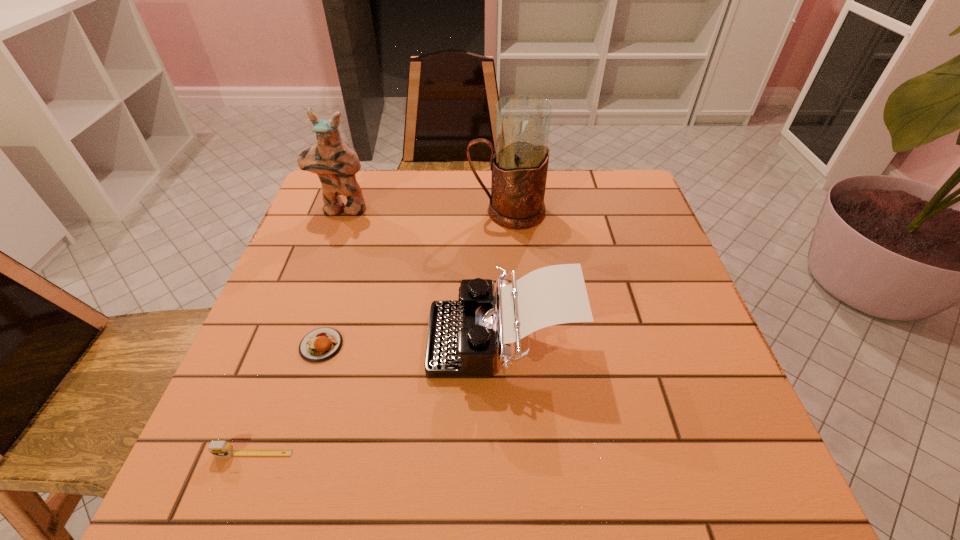
At what (x,y) coordinates should I click in order to perform the action: click on free region located on the keys of the third tallest object. Please return your answer as a coordinate pair (x, y). This screenshot has height=540, width=960. Looking at the image, I should click on (365, 339).

The width and height of the screenshot is (960, 540). I want to click on vacant space located on the keys of the third tallest object, so (266, 339).

Where is `free point located 0.100m on the keys of the third tallest object`? Image resolution: width=960 pixels, height=540 pixels. free point located 0.100m on the keys of the third tallest object is located at coordinates (379, 339).

Find the location of `free space located 0.310m on the back of the shortest object`. free space located 0.310m on the back of the shortest object is located at coordinates (356, 233).

Where is `pitcher at the far edge`? The width and height of the screenshot is (960, 540). pitcher at the far edge is located at coordinates (519, 166).

Find the location of a particular element. The image size is (960, 540). figurine situated at the far edge is located at coordinates (333, 160).

I want to click on object present at the near edge, so (217, 448).

Locate an element on the screen. figurine located at the left edge is located at coordinates (333, 160).

Locate an element on the screen. tape measure that is at the left edge is located at coordinates (217, 448).

Find the location of a particular element. The image size is (960, 540). patty (food) that is at the left edge is located at coordinates (321, 344).